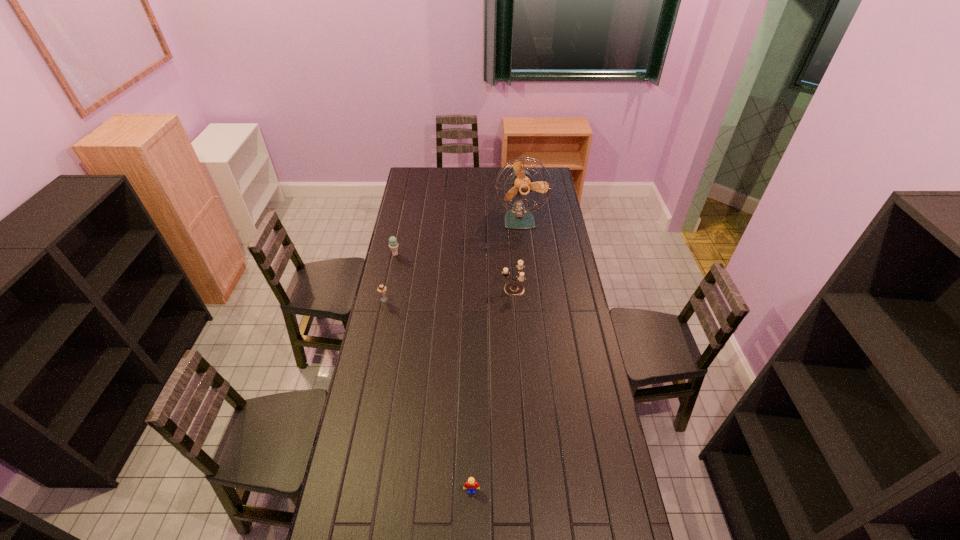
At what (x,y) coordinates should I click in order to perform the action: click on fan. Please return your answer as a coordinate pair (x, y). This screenshot has height=540, width=960. Looking at the image, I should click on (518, 217).

Find the location of `the tallest object`. the tallest object is located at coordinates (518, 217).

Find the location of a particular element. This screenshot has height=540, width=960. the second tallest object is located at coordinates (514, 288).

The image size is (960, 540). In order to click on the nearer ice cream in this screenshot , I will do `click(381, 289)`.

The height and width of the screenshot is (540, 960). In order to click on the farther ice cream in this screenshot , I will do `click(393, 244)`.

The width and height of the screenshot is (960, 540). Identify the location of the shortest object. (471, 484).

Image resolution: width=960 pixels, height=540 pixels. I want to click on the third object from right to left, so click(x=471, y=484).

The image size is (960, 540). I want to click on vacant space situated 0.320m on the front-facing side of the tallest object for air flow, so click(526, 277).

Identify the location of vacant space located 0.310m on the left of the second tallest object. This screenshot has width=960, height=540. (435, 289).

In order to click on vacant space located 0.390m on the back of the nearer ice cream in this screenshot , I will do `click(396, 243)`.